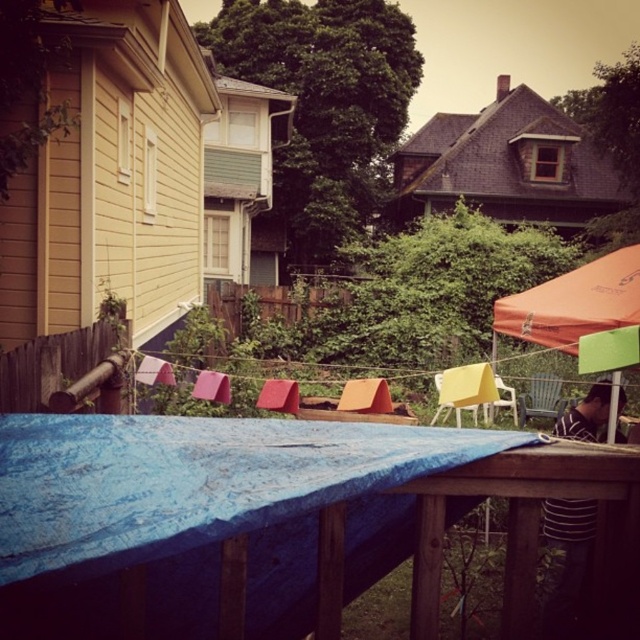
Between brown wooden fence at left and yellow plastic chair at center, which one appears on the left side from the viewer's perspective?

brown wooden fence at left

Who is more distant from viewer, (x=44, y=371) or (x=436, y=396)?

The point (x=436, y=396) is more distant.

You are a GUI agent. You are given a task and a screenshot of the screen. Output one action in this format:
    pyautogui.click(x=<x>, y=<y>)
    Task: Click on the brown wooden fence at left
    
    Given the screenshot: What is the action you would take?
    pyautogui.click(x=60, y=365)

Does blue tarp at center lie in front of orange fabric canopy at upper right?

Yes.

Who is taller, blue tarp at center or orange fabric canopy at upper right?

Standing taller between the two is orange fabric canopy at upper right.

Who is more forward, (116, 516) or (522, 333)?

Point (116, 516) is in front.

You are a GUI agent. You are given a task and a screenshot of the screen. Output one action in this format:
    pyautogui.click(x=<x>, y=<y>)
    Task: Click on the blue tarp at center
    The width and height of the screenshot is (640, 640).
    Given the screenshot: What is the action you would take?
    pyautogui.click(x=273, y=516)

Does wooden chair at right have a larger size compared to yellow plastic chair at center?

Yes.

Who is more forward, (x=531, y=410) or (x=435, y=378)?

Positioned in front is point (x=531, y=410).

Where is `wooden chair at right`? The image size is (640, 640). wooden chair at right is located at coordinates (540, 397).